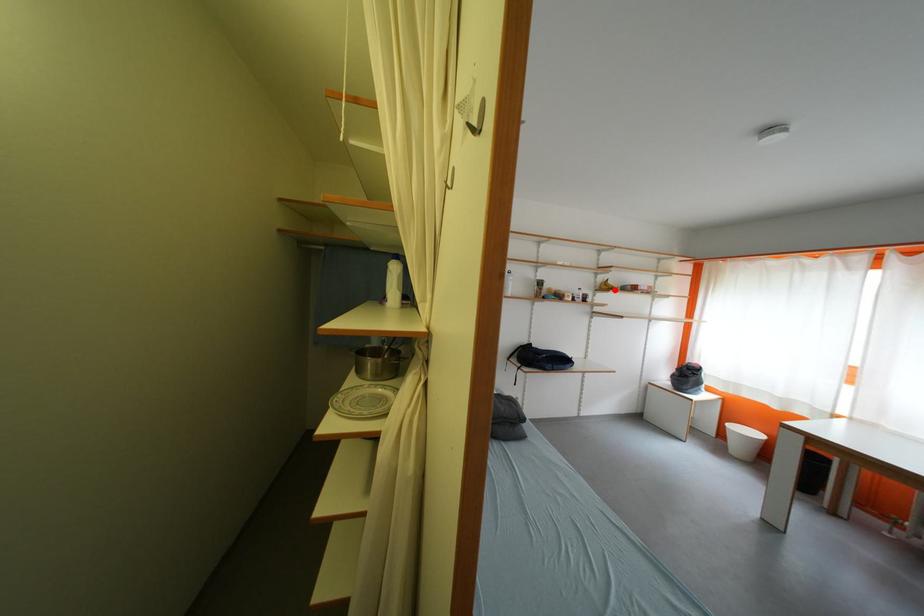
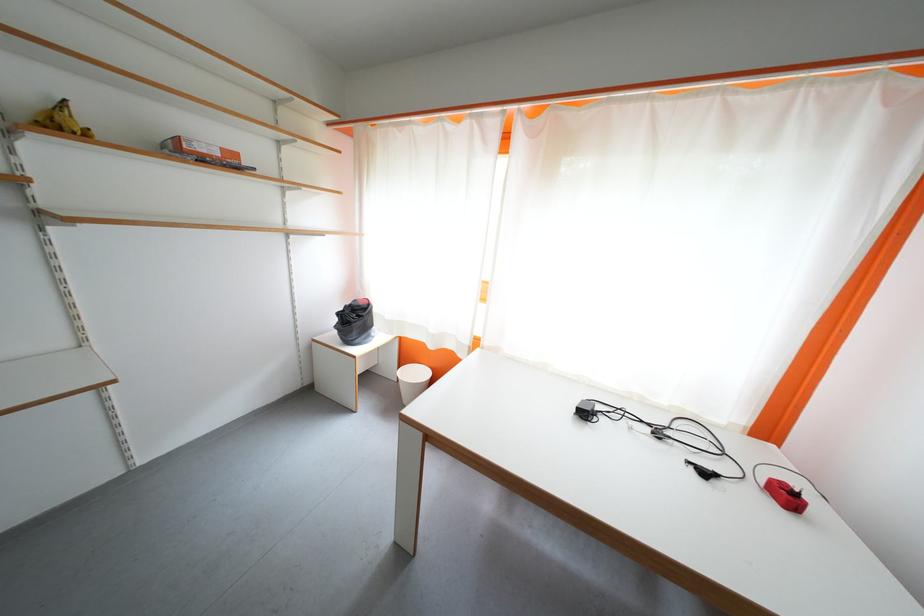
Question: I am providing you with two images of the same scene from different viewpoints. A red point is marked on the first image. Can you still see the location of the red point in image 2?

Choices:
 (A) Yes
 (B) No

Answer: (A)